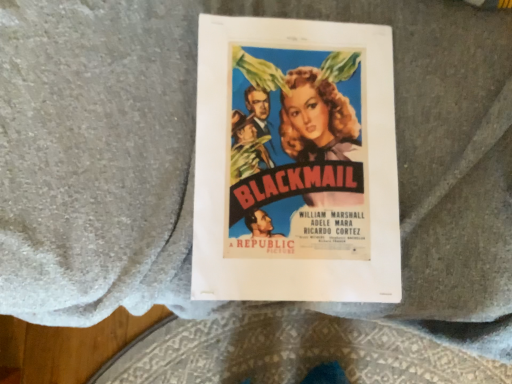
In order to click on matte paper poster at center in this screenshot , I will do `click(295, 162)`.

Describe the element at coordinates (295, 162) in the screenshot. I see `matte paper poster at center` at that location.

Where is `matte paper poster at center`? The image size is (512, 384). matte paper poster at center is located at coordinates click(295, 162).